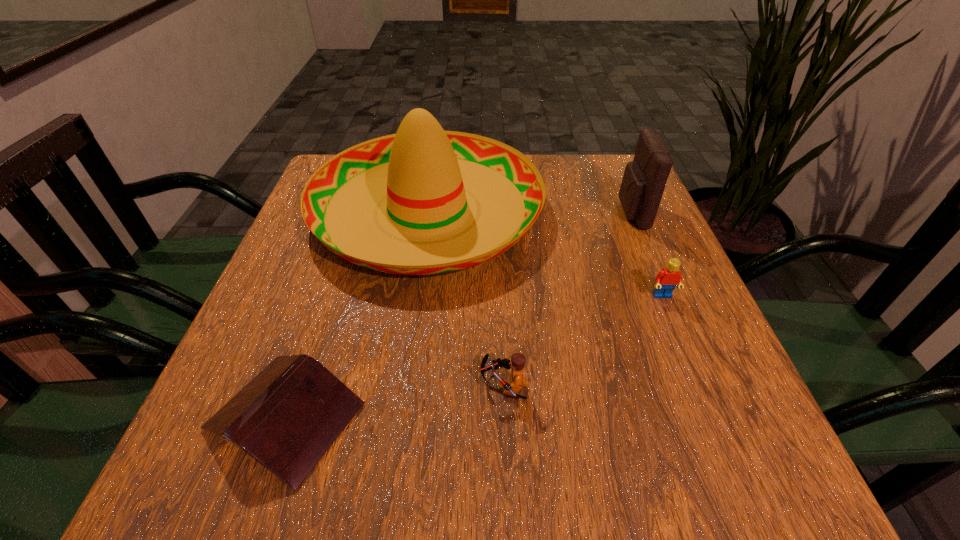
Locate which object is the closest to the sombrero. Please provide its 2D coordinates. Your answer should be formatted as a tuple, i.e. [(x, y)], where the tuple contains the x and y coordinates of a point satisfying the conditions above.

[(287, 417)]

Identify the location of free point that satisfies the following two spatial constraints: 1. with an open flap on the fourth shortest object; 2. on the face of the right Lego. (666, 296).

Image resolution: width=960 pixels, height=540 pixels. I want to click on free space that satisfies the following two spatial constraints: 1. with an open flap on the pouch; 2. on the face of the right Lego, so click(x=666, y=296).

Where is `free space that satisfies the following two spatial constraints: 1. with an open flap on the pouch; 2. on the face of the farther Lego`? This screenshot has height=540, width=960. free space that satisfies the following two spatial constraints: 1. with an open flap on the pouch; 2. on the face of the farther Lego is located at coordinates (666, 296).